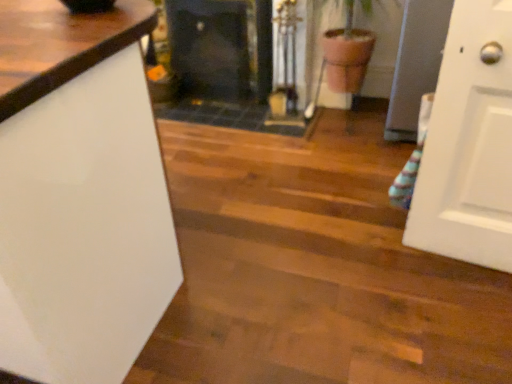
Locate an element on the screen. The width and height of the screenshot is (512, 384). free space in front of black glass fireplace at center, which ranks as the first fireplace in left-to-right order is located at coordinates (214, 115).